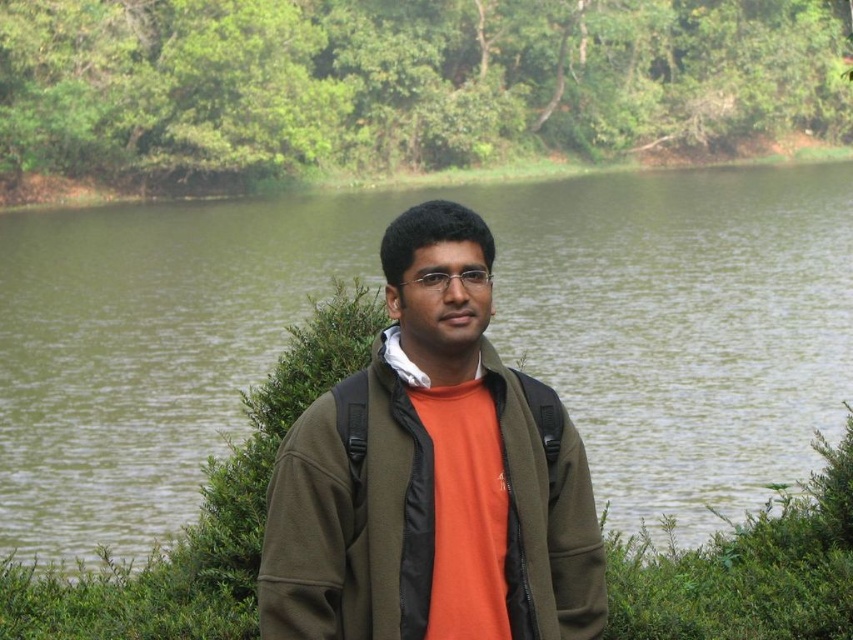
Question: Which point is closer to the camera?

Choices:
 (A) (461, 436)
 (B) (74, 422)

Answer: (A)

Question: Can you confirm if green water at center is positioned above matte green jacket at center?

Choices:
 (A) no
 (B) yes

Answer: (B)

Question: Which point is farther to the camera?

Choices:
 (A) (393, 492)
 (B) (799, 372)

Answer: (B)

Question: Is green water at center further to the viewer compared to matte green jacket at center?

Choices:
 (A) yes
 (B) no

Answer: (A)

Question: In this image, where is green water at center located relative to matte green jacket at center?

Choices:
 (A) left
 (B) right

Answer: (A)

Question: Which of the following is the farthest from the observer?

Choices:
 (A) green water at center
 (B) matte green jacket at center

Answer: (A)